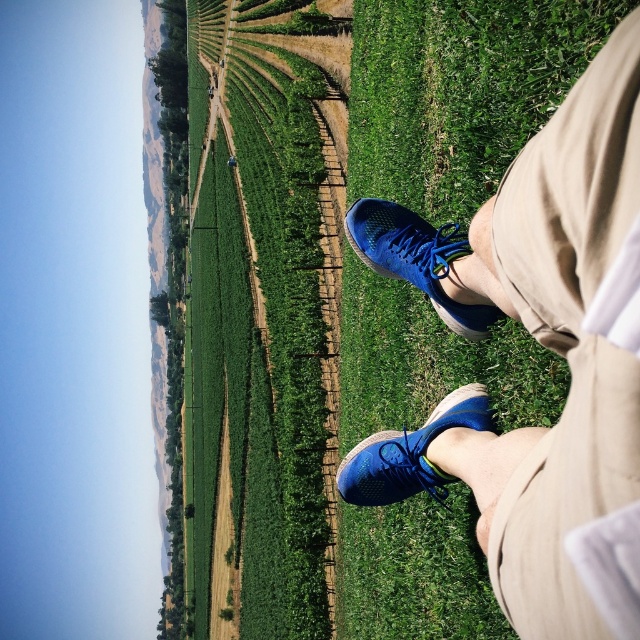
You are standing in a vineyard and see the green grass at center and the blue mesh shoe at lower right. Which object is closer to your feet?

The blue mesh shoe at lower right is closer to your feet because it is positioned lower in the image, which typically indicates proximity in a first person perspective.

You are standing in a vineyard and notice the green grass at center and the blue mesh shoe at lower right. Which object covers a wider area?

The green grass at center covers a wider area than the blue mesh shoe at lower right because its width is larger.